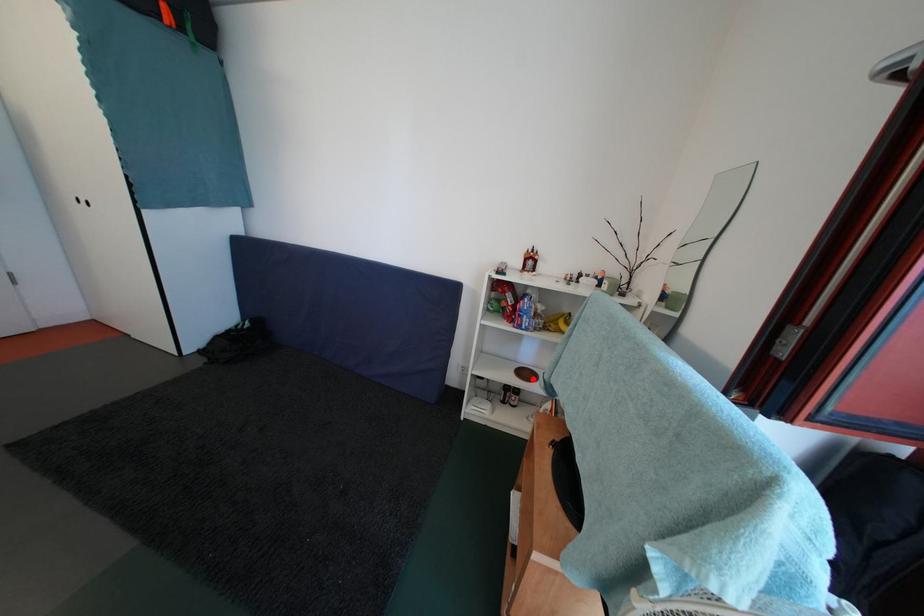
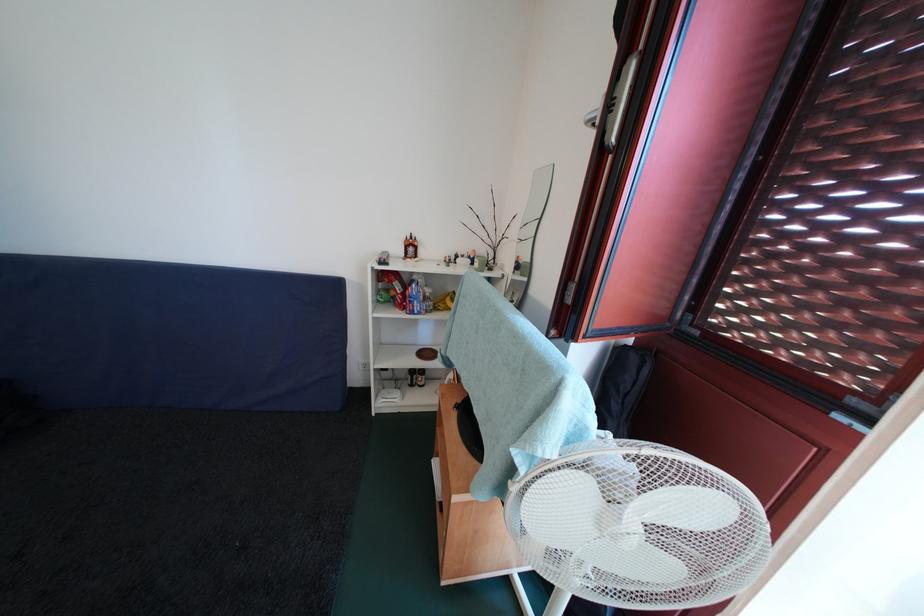
Question: I am providing you with two images of the same scene from different viewpoints. Given a red point in image1, look at the same physical point in image2. Is it:

Choices:
 (A) Closer to the viewpoint
 (B) Farther from the viewpoint

Answer: (B)